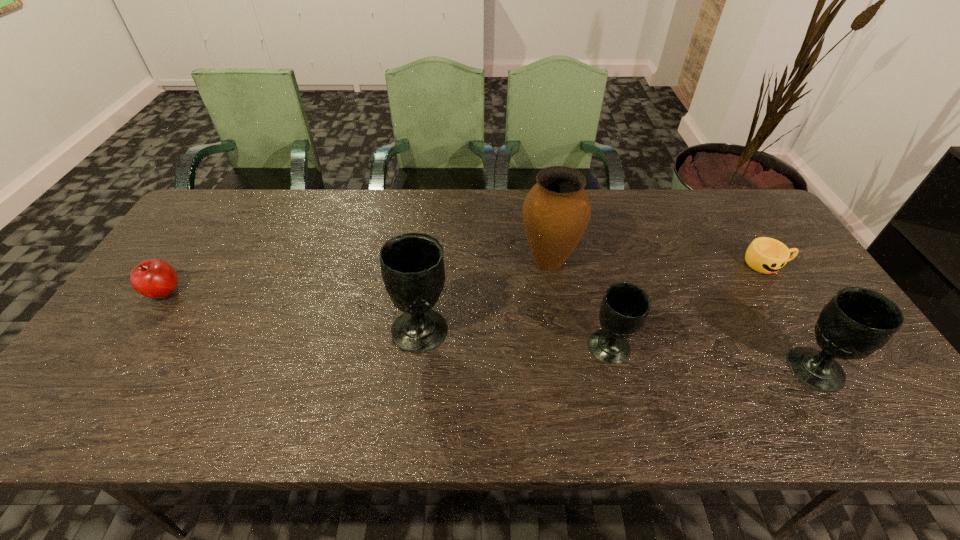
In the image, there is a desktop. What are the coordinates of `free space at the near edge` in the screenshot? It's located at (529, 365).

The height and width of the screenshot is (540, 960). Find the location of `vacant space at the right edge of the desktop`. vacant space at the right edge of the desktop is located at coordinates (792, 319).

The width and height of the screenshot is (960, 540). In the image, there is a desktop. Find the location of `vacant space at the far right corner`. vacant space at the far right corner is located at coordinates (724, 231).

You are a GUI agent. You are given a task and a screenshot of the screen. Output one action in this format:
    pyautogui.click(x=<x>, y=<y>)
    Task: Click on the free spot between the second chalice from right to left and the fourth shortest object
    Image resolution: width=960 pixels, height=540 pixels.
    Given the screenshot: What is the action you would take?
    pyautogui.click(x=711, y=359)

At what (x,y) coordinates should I click in order to perform the action: click on free spot between the shortest object and the urn. Please return your answer as a coordinate pair (x, y). Looking at the image, I should click on (658, 262).

Find the location of a particular element. This screenshot has height=540, width=960. free area in between the leftmost chalice and the urn is located at coordinates (485, 295).

This screenshot has height=540, width=960. Identify the location of free space that is in between the urn and the second shortest chalice. (682, 315).

The width and height of the screenshot is (960, 540). In order to click on free space between the urn and the second tallest chalice in this screenshot , I will do `click(682, 315)`.

Image resolution: width=960 pixels, height=540 pixels. Identify the location of free space between the cup and the urn. (658, 262).

Locate an element on the screen. This screenshot has width=960, height=540. free space that is in between the second chalice from right to left and the fourth shortest object is located at coordinates (711, 359).